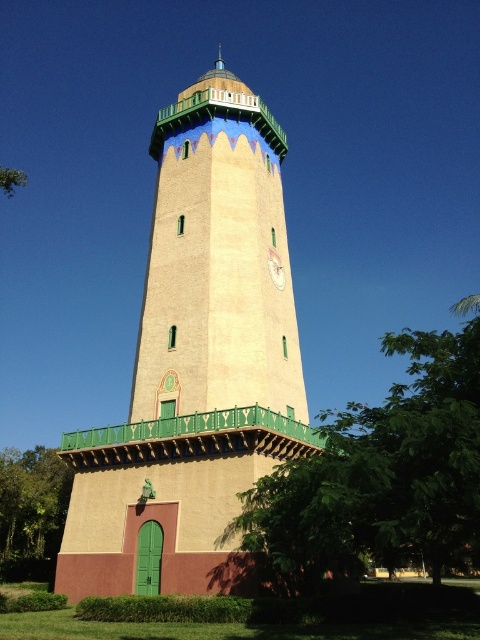
You are standing in a park and see the beige stucco bell tower at center and the green leafy tree at center. Which object is larger in size?

The beige stucco bell tower at center has a smaller size compared to the green leafy tree at center, so the green leafy tree at center is larger in size.

You are standing in front of the tower and want to know which object is larger between the green leafy tree at center and the matte gold clock at center. Can you tell me?

The green leafy tree at center is bigger than the matte gold clock at center.

You are an architect designing a new clock for the beige stucco bell tower at center. The current matte gold clock at center is too small compared to the tower. How should you adjust the clock size to match the tower?

The beige stucco bell tower at center is wider than the matte gold clock at center. To match the tower, the new clock should be made larger so its width is proportionate to the tower.